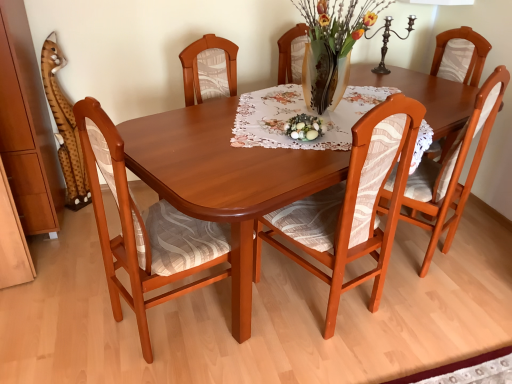
Image resolution: width=512 pixels, height=384 pixels. I want to click on free space underneath matte wood chair at center, positioned as the 2th chair in left-to-right order (from a real-world perspective), so pos(314,301).